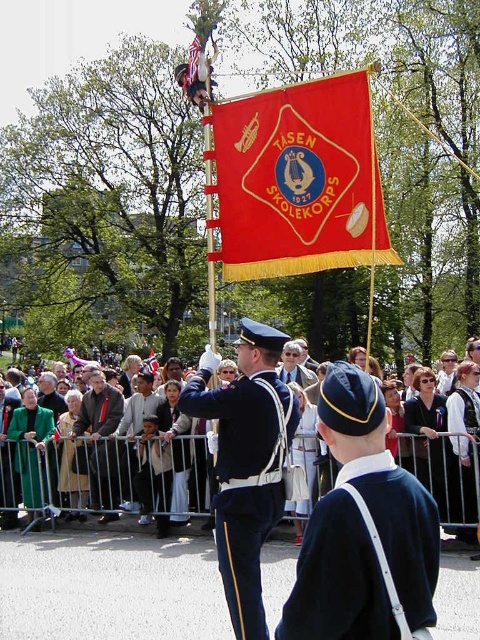
Question: Which of the following is the closest to the observer?

Choices:
 (A) (46, 408)
 (B) (303, 365)
 (C) (24, 468)

Answer: (C)

Question: Can you confirm if light beige fabric crowd at center is positioned above navy blue fabric at center?

Choices:
 (A) no
 (B) yes

Answer: (A)

Question: Which point is closer to the camera?

Choices:
 (A) (43, 492)
 (B) (253, 93)
 (C) (254, 518)

Answer: (C)

Question: Does dark brown leather jacket at center have a lesser width compared to black fabric uniform at center?

Choices:
 (A) no
 (B) yes

Answer: (A)

Question: Is dark blue fabric uniform at center wider than dark brown leather jacket at center?

Choices:
 (A) no
 (B) yes

Answer: (B)

Question: Which point is closer to the camera?

Choices:
 (A) (294, 340)
 (B) (263, 518)
 (C) (462, 449)
 (D) (309, 461)

Answer: (B)